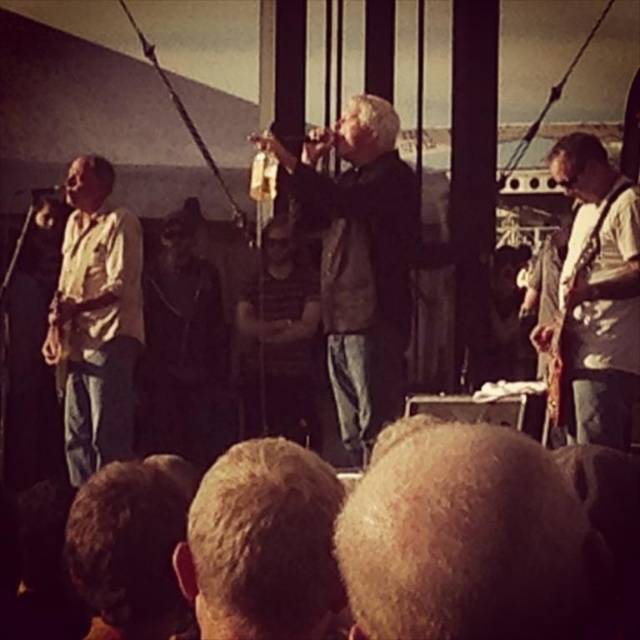
Question: Is dark matte jacket at center smaller than striped shirt at center?

Choices:
 (A) yes
 (B) no

Answer: (A)

Question: Which point appears farthest from the camera in this image?

Choices:
 (A) (570, 252)
 (B) (259, 333)
 (C) (99, 433)
 (D) (404, 637)

Answer: (B)

Question: Can you confirm if white matte guitar at right is positioned above dark matte jacket at center?

Choices:
 (A) no
 (B) yes

Answer: (A)

Question: Among these points, which one is farthest from the camera?

Choices:
 (A) (160, 420)
 (B) (600, 365)
 (C) (445, 458)
 (D) (403, 260)

Answer: (A)

Question: Does white matte guitar at right appear on the left side of dark matte jacket at center?

Choices:
 (A) yes
 (B) no

Answer: (B)

Question: Which object is farther from the camera taking this photo?

Choices:
 (A) light brown hair at center
 (B) light brown shirt at left
 (C) gray hair at center

Answer: (B)